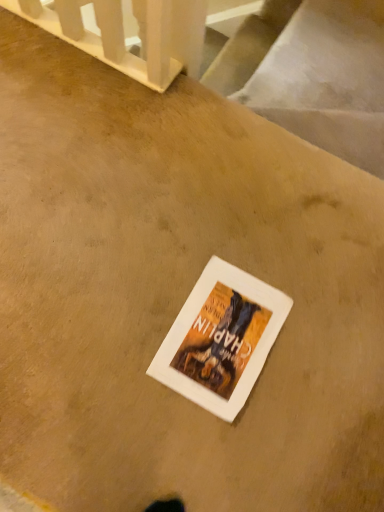
This screenshot has width=384, height=512. What are the coordinates of `vacant space in front of white paper book at center` in the screenshot? It's located at (196, 444).